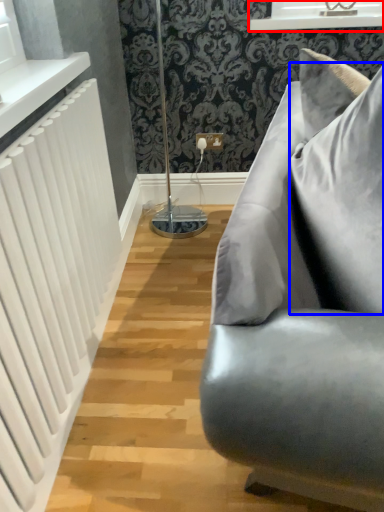
Question: Which object appears farthest to the camera in this image, window frame (highlighted by a red box) or pillow (highlighted by a blue box)?

Choices:
 (A) window frame
 (B) pillow

Answer: (A)